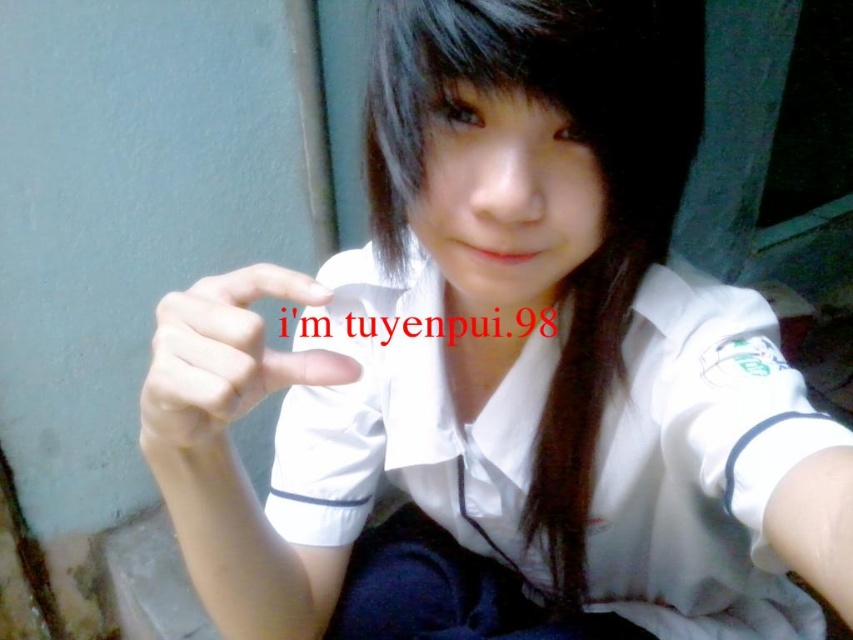
You are a photographer adjusting the lighting in a studio. You notice the subject has black silky hair at center and a white matte hand at center. Which object should you adjust the lighting on to make the taller one stand out more?

The black silky hair at center is taller than the white matte hand at center. To make the taller one stand out more, adjust the lighting on the black silky hair at center.

You are standing 20 inches away from the image. You want to touch the point at point (426,49) with your finger. Can you reach it without moving closer?

The distance of point (426,49) from viewer is 15.84 inches. Since you are standing 20 inches away, you cannot reach it without moving closer because the point is 15.84 inches away, which is farther than your current distance of 20 inches.